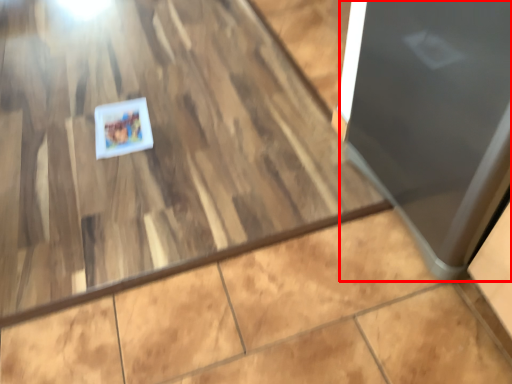
Question: From the image, what is the correct spatial relationship of door (annotated by the red box) in relation to postcard?

Choices:
 (A) right
 (B) left

Answer: (A)